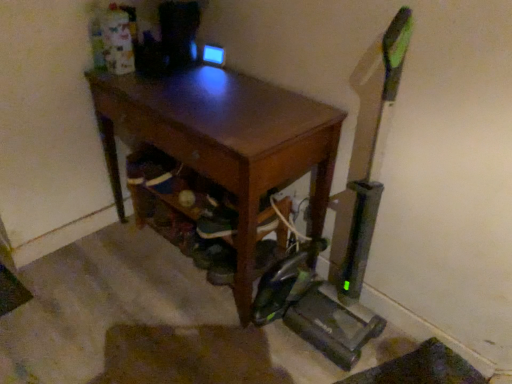
Question: Looking at their shapes, would you say green fabric shoe at lower center is wider or thinner than brown wooden desk at center?

Choices:
 (A) thin
 (B) wide

Answer: (A)

Question: In terms of size, does green fabric shoe at lower center appear bigger or smaller than brown wooden desk at center?

Choices:
 (A) big
 (B) small

Answer: (B)

Question: From the image's perspective, relative to brown wooden desk at center, is green fabric shoe at lower center above or below?

Choices:
 (A) below
 (B) above

Answer: (A)

Question: Is brown wooden desk at center bigger or smaller than green fabric shoe at lower center?

Choices:
 (A) big
 (B) small

Answer: (A)

Question: Would you say brown wooden desk at center is to the left or to the right of green fabric shoe at lower center in the picture?

Choices:
 (A) right
 (B) left

Answer: (B)

Question: Relative to green fabric shoe at lower center, is brown wooden desk at center in front or behind?

Choices:
 (A) behind
 (B) front

Answer: (B)

Question: From a real-world perspective, relative to green fabric shoe at lower center, is brown wooden desk at center vertically above or below?

Choices:
 (A) above
 (B) below

Answer: (A)